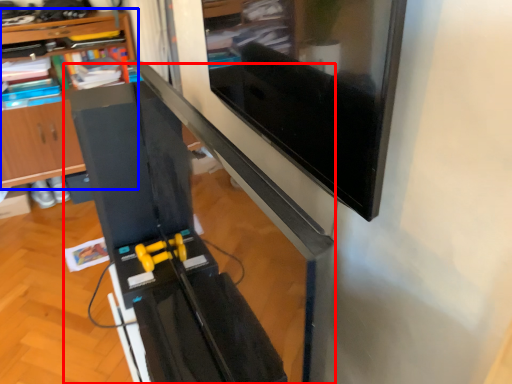
Question: Which object is closer to the camera taking this photo, computer desk (highlighted by a red box) or shelf (highlighted by a blue box)?

Choices:
 (A) computer desk
 (B) shelf

Answer: (A)